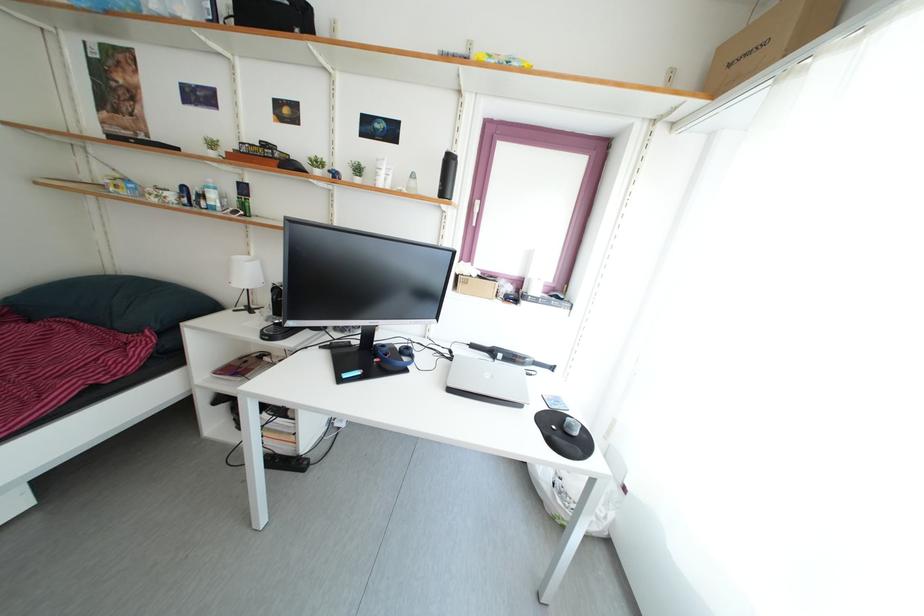
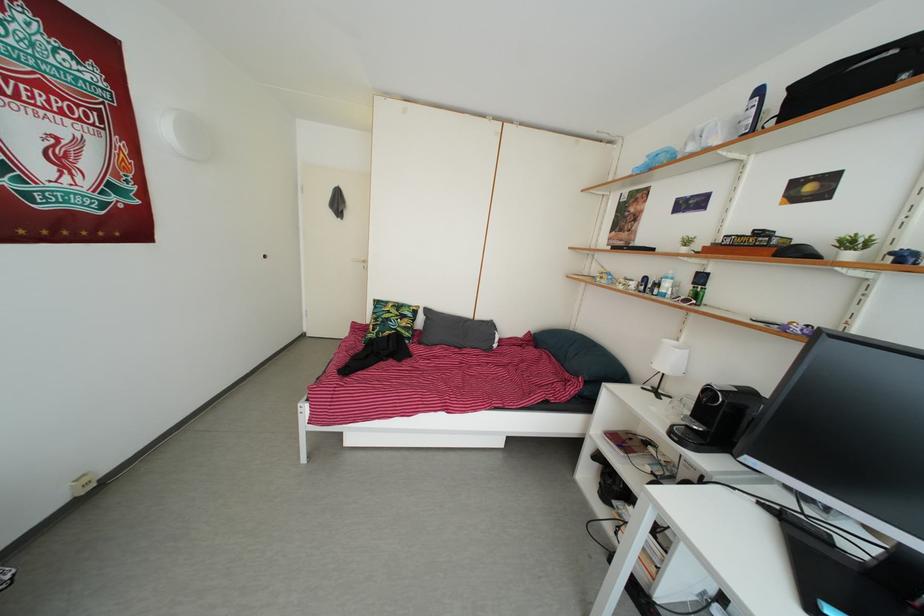
Question: The images are taken continuously from a first-person perspective. In which direction is your viewpoint rotating?

Choices:
 (A) Left
 (B) Right
 (C) Up
 (D) Down

Answer: (A)